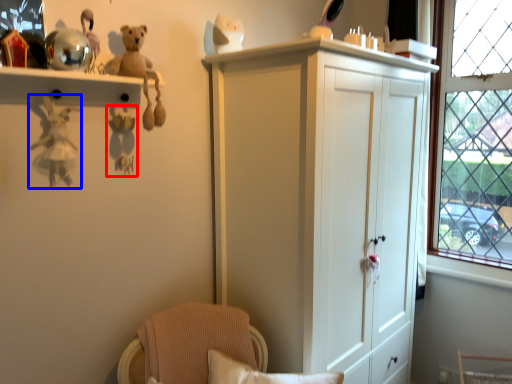
Question: Which object appears closest to the camera in this image, toy (highlighted by a red box) or toy (highlighted by a blue box)?

Choices:
 (A) toy
 (B) toy

Answer: (B)